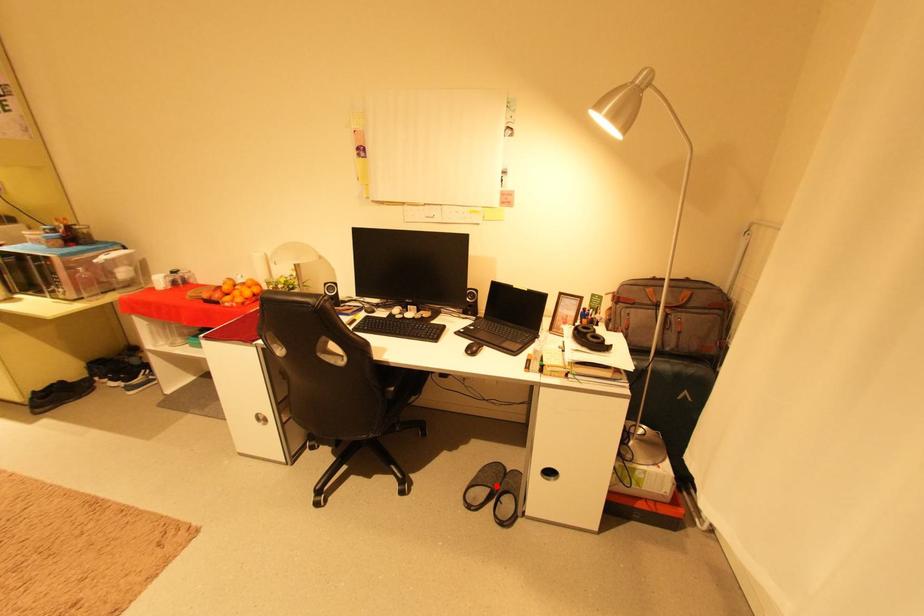
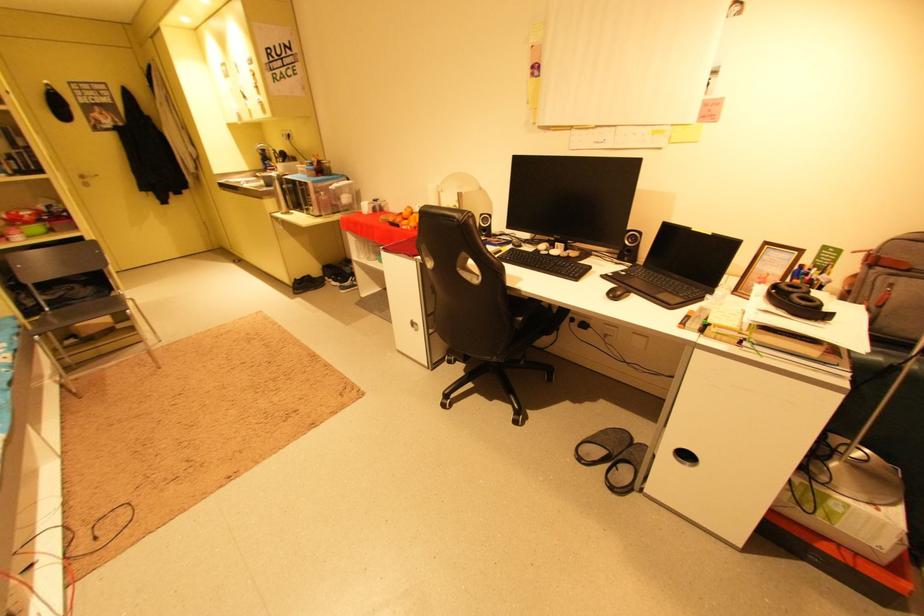
Question: I am providing you with two images of the same scene from different viewpoints. In image1, a red point is highlighted. Considering the same 3D point in image2, which of the following is correct?

Choices:
 (A) It is closer
 (B) It is farther

Answer: (A)